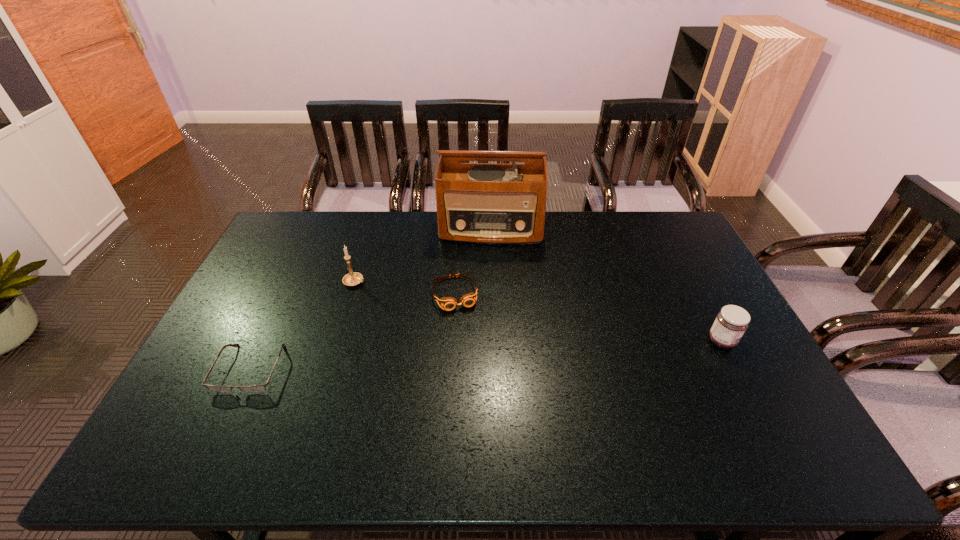
Where is `spectacles`? Image resolution: width=960 pixels, height=540 pixels. spectacles is located at coordinates (252, 388).

Find the location of `the leftmost object`. the leftmost object is located at coordinates (252, 388).

The image size is (960, 540). I want to click on the third shortest object, so point(732,321).

Where is `the rightmost object`? The width and height of the screenshot is (960, 540). the rightmost object is located at coordinates (732, 321).

Identify the location of the farthest object. (485, 203).

Identify the location of the tallest object. (485, 203).

Where is `candle holder`? candle holder is located at coordinates (353, 278).

Find the location of a particular element. the fourth object from right to left is located at coordinates click(x=353, y=278).

Find the location of a particular element. goggles is located at coordinates (448, 303).

You are a GUI agent. You are given a task and a screenshot of the screen. Output one action in this format:
    pyautogui.click(x=<x>, y=<y>)
    Task: Click on the free space located on the front panel of the radio receiver
    
    Given the screenshot: What is the action you would take?
    pyautogui.click(x=485, y=317)